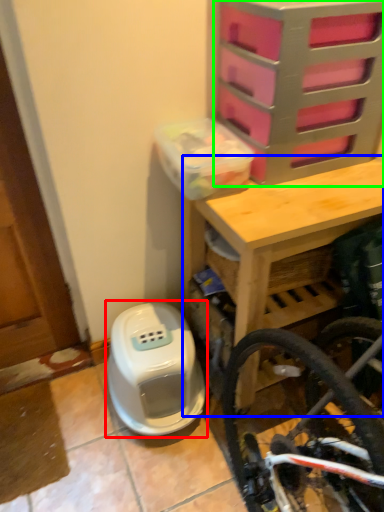
Question: Estimate the real-world distances between objects in this image. Which object is farther from water heater (highlighted by a red box), table (highlighted by a blue box) or drawer (highlighted by a green box)?

Choices:
 (A) table
 (B) drawer

Answer: (B)